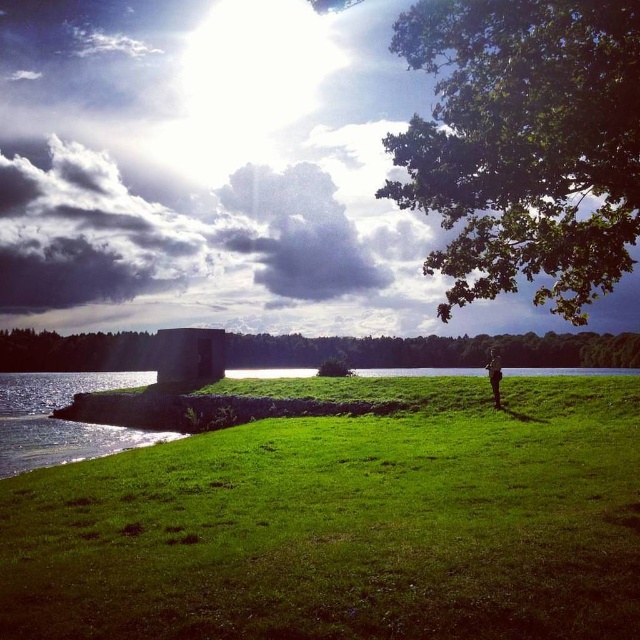
Question: Is green leafy tree at upper right below green leafy tree at center?

Choices:
 (A) no
 (B) yes

Answer: (A)

Question: Is green leafy tree at upper right above green fabric jacket at center?

Choices:
 (A) no
 (B) yes

Answer: (B)

Question: Which of the following is the farthest from the observer?

Choices:
 (A) (497, 390)
 (B) (410, 17)
 (C) (406, 573)
 (D) (51, 368)

Answer: (D)

Question: Which point appears farthest from the camera in this image?

Choices:
 (A) (115, 340)
 (B) (444, 513)
 (C) (492, 380)
 (D) (637, 128)

Answer: (A)

Question: Does green leafy tree at upper right have a smaller size compared to green leafy tree at center?

Choices:
 (A) no
 (B) yes

Answer: (A)

Question: Among these objects, which one is farthest from the camera?

Choices:
 (A) green grassy at center
 (B) green leafy tree at upper right

Answer: (B)